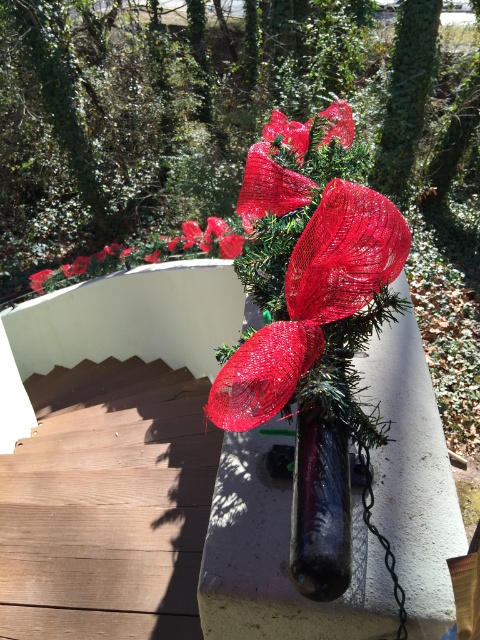
Is brown wooden stairs at lower left bigger than shiny red ribbon at center?

Yes.

What do you see at coordinates (107, 504) in the screenshot? I see `brown wooden stairs at lower left` at bounding box center [107, 504].

Between point (49, 422) and point (343, 300), which one is positioned behind?

The point (49, 422) is behind.

Identify the location of brown wooden stairs at lower left. The image size is (480, 640). (107, 504).